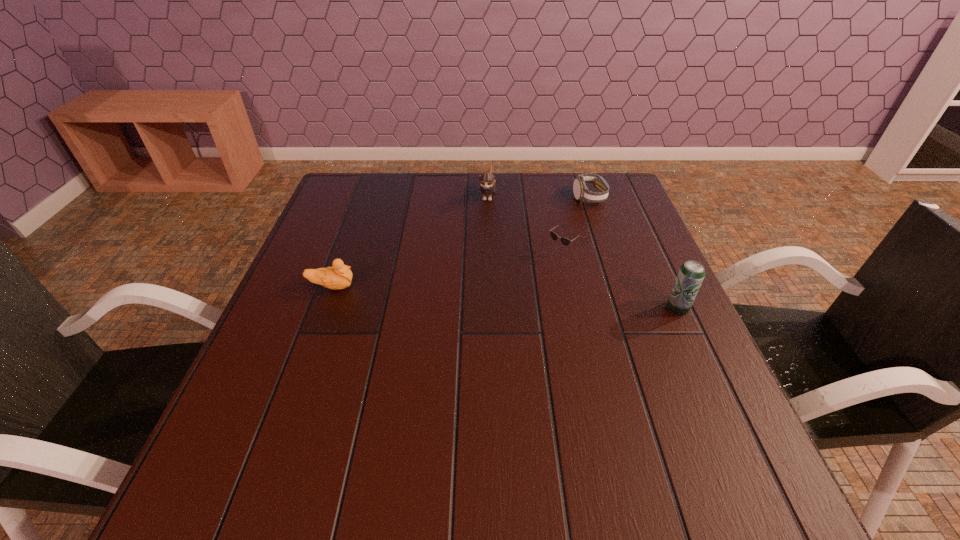
Find the location of a particular element. The height and width of the screenshot is (540, 960). vacant space on the desktop that is between the second nearest object and the beer can and is positioned on the face of the watch is located at coordinates (527, 299).

This screenshot has height=540, width=960. I want to click on free space on the desktop that is between the leftmost object and the rightmost object and is positioned in front of the lenses of the third farthest object, so click(504, 298).

The image size is (960, 540). In order to click on vacant space on the desktop that is between the duckling and the rightmost object and is positioned on the front-facing side of the fourth object from right to left in this screenshot , I will do pyautogui.click(x=465, y=295).